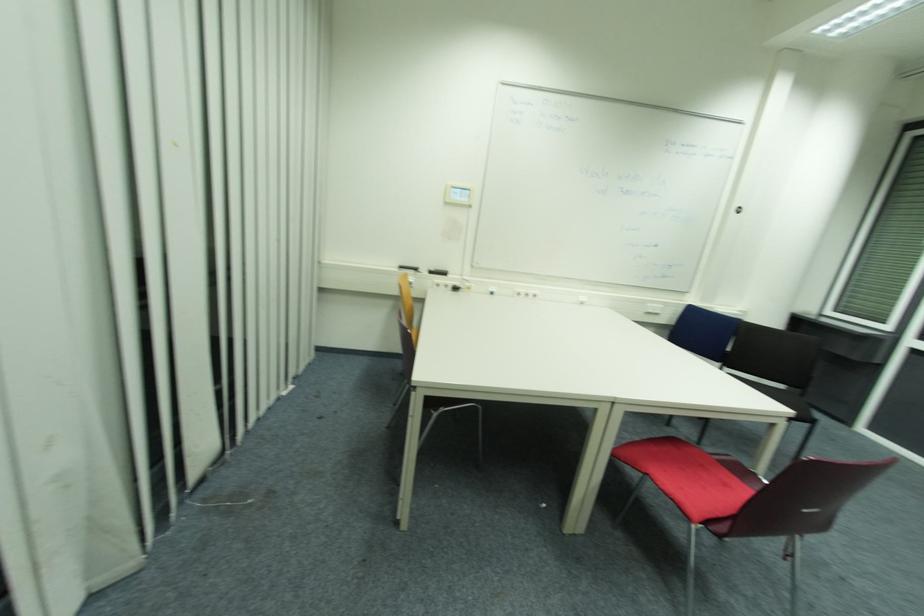
Locate an element on the screen. red chair sitting surface is located at coordinates (695, 480).